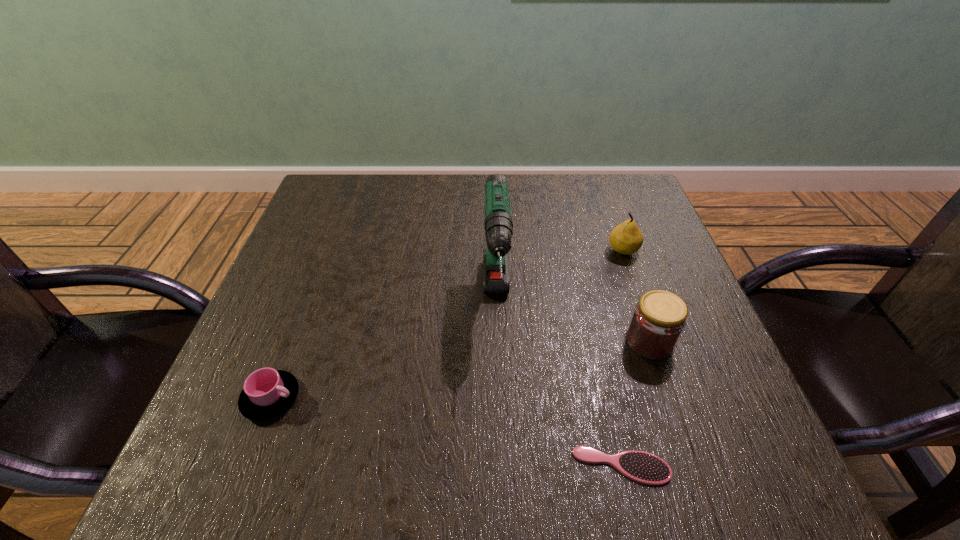
Where is `free region located on the back of the jam`? The image size is (960, 540). free region located on the back of the jam is located at coordinates (636, 304).

Find the location of a particular element. This screenshot has height=540, width=960. free location located on the side with the handle of the cup is located at coordinates (398, 398).

Identify the location of vacant region located on the left of the nearest object. The width and height of the screenshot is (960, 540). (483, 466).

Where is `object present at the near edge`? object present at the near edge is located at coordinates (643, 467).

I want to click on object that is at the left edge, so click(267, 393).

You are a GUI agent. You are given a task and a screenshot of the screen. Output one action in this format:
    pyautogui.click(x=<x>, y=<y>)
    Task: Click on the pear that is at the right edge
    This screenshot has height=540, width=960.
    Given the screenshot: What is the action you would take?
    pyautogui.click(x=626, y=238)

Locate an element on the screen. jam at the right edge is located at coordinates (659, 318).

Identify the location of hairbrush that is positioned at the right edge. (643, 467).

Locate an element on the screen. object that is at the near right corner is located at coordinates (643, 467).

Where is `free space at the far edge`? The height and width of the screenshot is (540, 960). free space at the far edge is located at coordinates (375, 216).